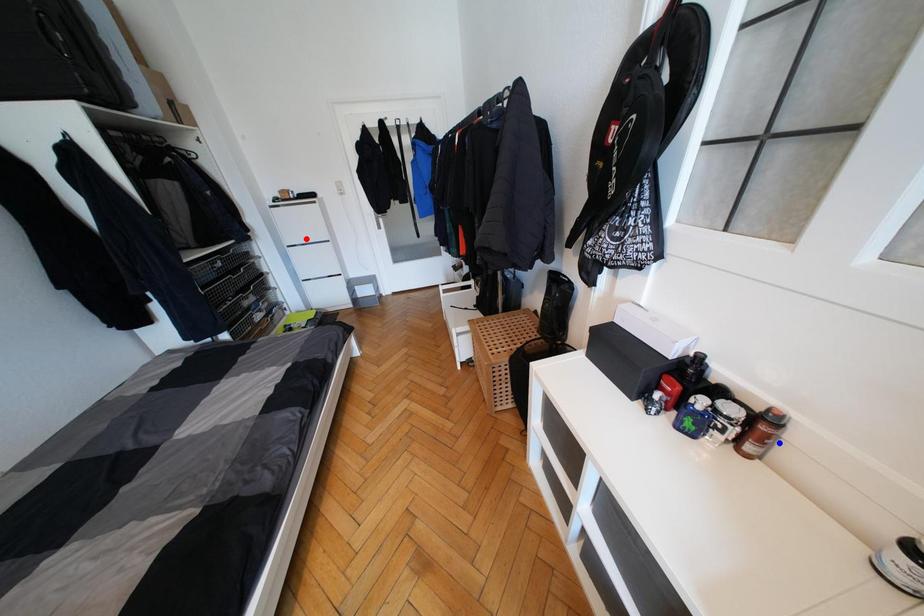
Question: Which of the two points in the image is closer to the camera?

Choices:
 (A) Blue point is closer.
 (B) Red point is closer.

Answer: (A)